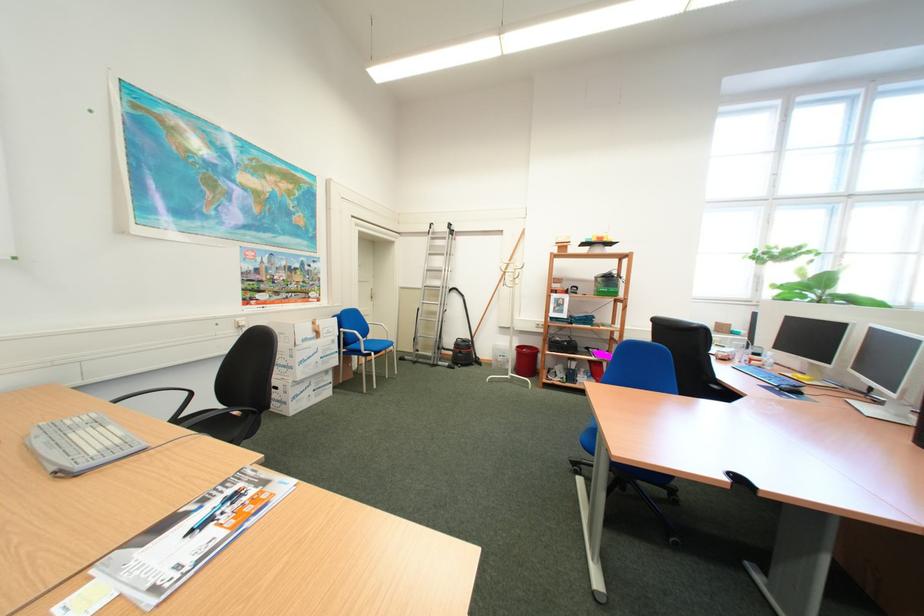
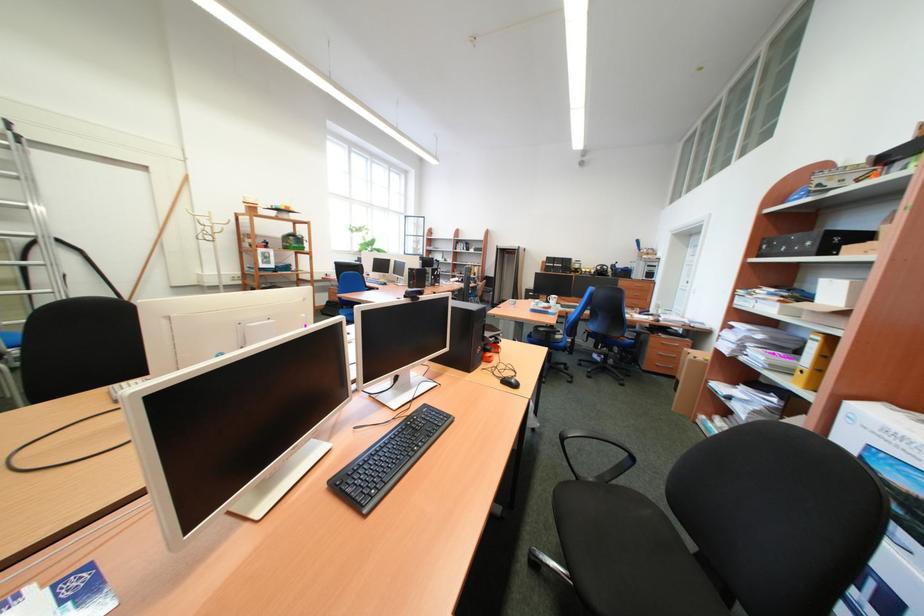
Question: I am providing you with two images of the same scene from different viewpoints. Please identify which objects are invisible in image2.

Choices:
 (A) yellow file binder
 (B) white mug handle
 (C) red trash bin
 (D) orange rectangular box

Answer: (C)